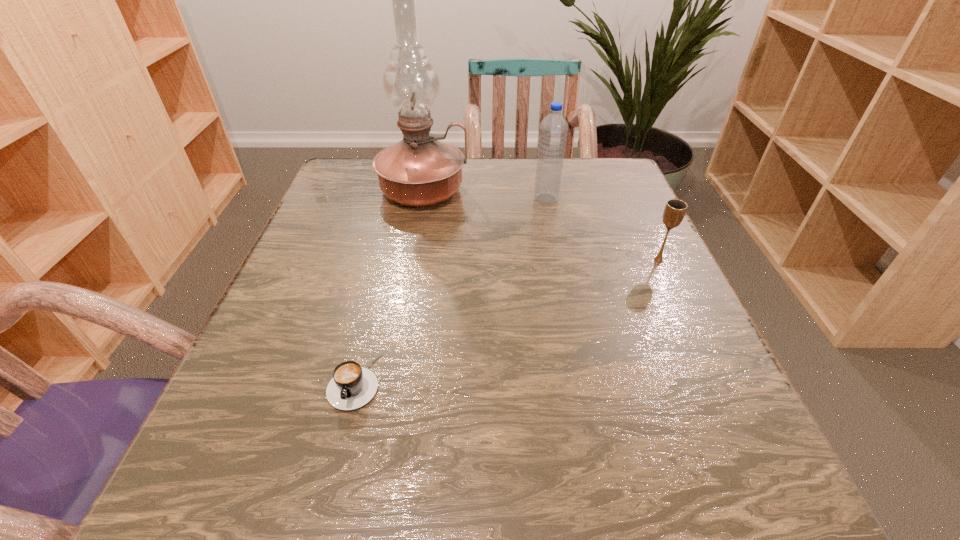
Find the location of a particular element. The height and width of the screenshot is (540, 960). vacant space located with the handle on the side of the shortest object is located at coordinates (335, 462).

At what (x,y) coordinates should I click in order to perform the action: click on oil lamp located in the far edge section of the desktop. Please return your answer as a coordinate pair (x, y). This screenshot has width=960, height=540. Looking at the image, I should click on (419, 170).

You are a GUI agent. You are given a task and a screenshot of the screen. Output one action in this format:
    pyautogui.click(x=<x>, y=<y>)
    Task: Click on the water bottle present at the far edge
    
    Given the screenshot: What is the action you would take?
    pyautogui.click(x=553, y=132)

At what (x,y) coordinates should I click in order to perform the action: click on oil lamp located in the left edge section of the desktop. Please return your answer as a coordinate pair (x, y). The image size is (960, 540). Looking at the image, I should click on (419, 170).

Image resolution: width=960 pixels, height=540 pixels. Find the location of `cappuccino at the left edge`. cappuccino at the left edge is located at coordinates (352, 386).

Locate an element on the screen. The image size is (960, 540). object that is at the right edge is located at coordinates (675, 209).

This screenshot has width=960, height=540. In order to click on object that is at the far left corner in this screenshot , I will do `click(419, 170)`.

Image resolution: width=960 pixels, height=540 pixels. In order to click on free space at the far edge in this screenshot , I will do `click(492, 184)`.

This screenshot has width=960, height=540. In the image, there is a desktop. Find the location of `vacant area at the near edge`. vacant area at the near edge is located at coordinates (481, 484).

Where is `free space at the left edge`? The image size is (960, 540). free space at the left edge is located at coordinates (291, 273).